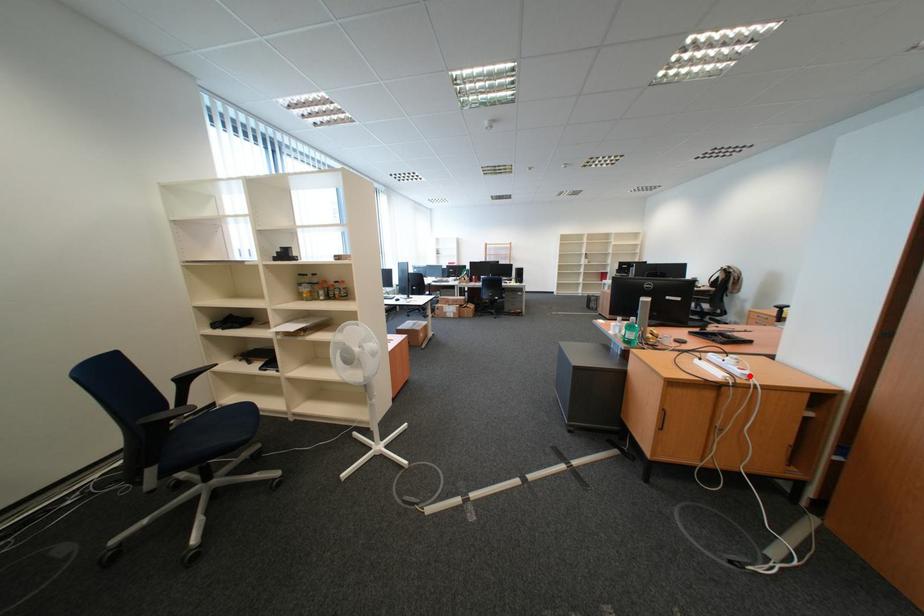
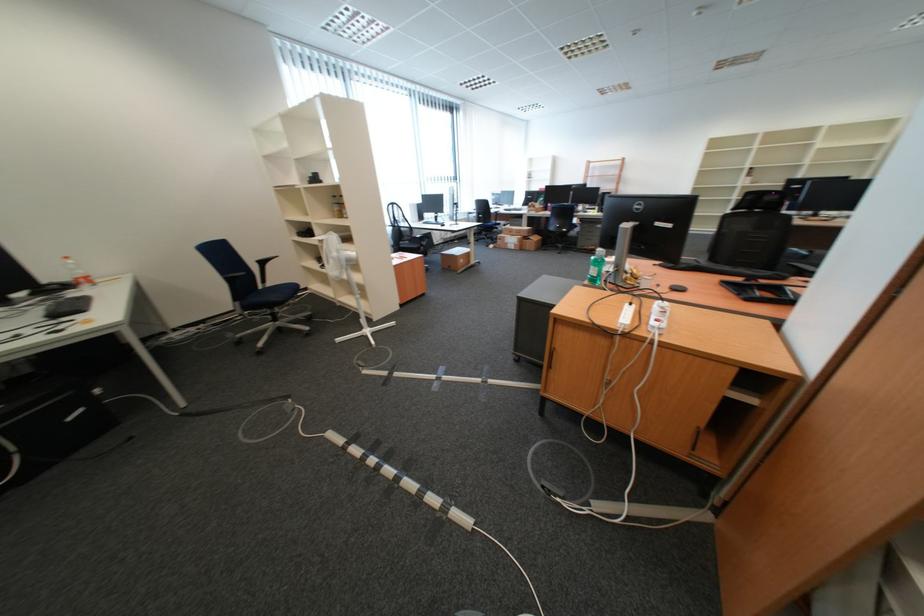
Find the pixel in the second image that matches the highlighted location in the first image.

(661, 328)